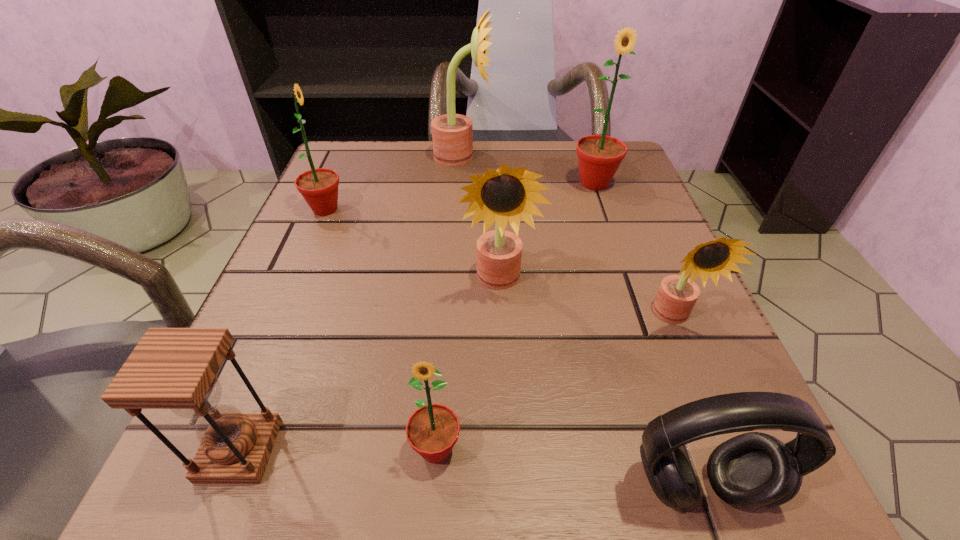
This screenshot has width=960, height=540. Identify the location of unoccupied area between the nearest green sunflower and the smallest yellow sunflower. (555, 383).

Find the location of a particular element. vacant space that is in between the second smallest yellow sunflower and the smallest yellow sunflower is located at coordinates (586, 299).

Find the location of a particular element. This screenshot has width=960, height=540. object that ranks as the sixth closest to the smallest green sunflower is located at coordinates (599, 156).

Identify which object is the nearest to the biggest yellow sunflower. Please provide its 2D coordinates. Your answer should be formatted as a tuple, i.e. [(x, y)], where the tuple contains the x and y coordinates of a point satisfying the conditions above.

[(599, 156)]

I want to click on the third closest sunflower relative to the gray headset, so click(506, 195).

Identify the location of sunflower that can be found as the fourth closest to the second biggest yellow sunflower. (319, 187).

At what (x,y) coordinates should I click in order to perform the action: click on the closest yellow sunflower to the farthest yellow sunflower. Please return your answer as a coordinate pair (x, y). Looking at the image, I should click on (506, 195).

Locate which yellow sunflower is the third closest to the leftmost green sunflower. Please provide its 2D coordinates. Your answer should be formatted as a tuple, i.e. [(x, y)], where the tuple contains the x and y coordinates of a point satisfying the conditions above.

[(677, 295)]

Choose which green sunflower is the third nearest neighbor to the hourglass. Please provide its 2D coordinates. Your answer should be formatted as a tuple, i.e. [(x, y)], where the tuple contains the x and y coordinates of a point satisfying the conditions above.

[(599, 156)]

Where is `green sunflower that is the second closest to the hourglass`? green sunflower that is the second closest to the hourglass is located at coordinates (319, 187).